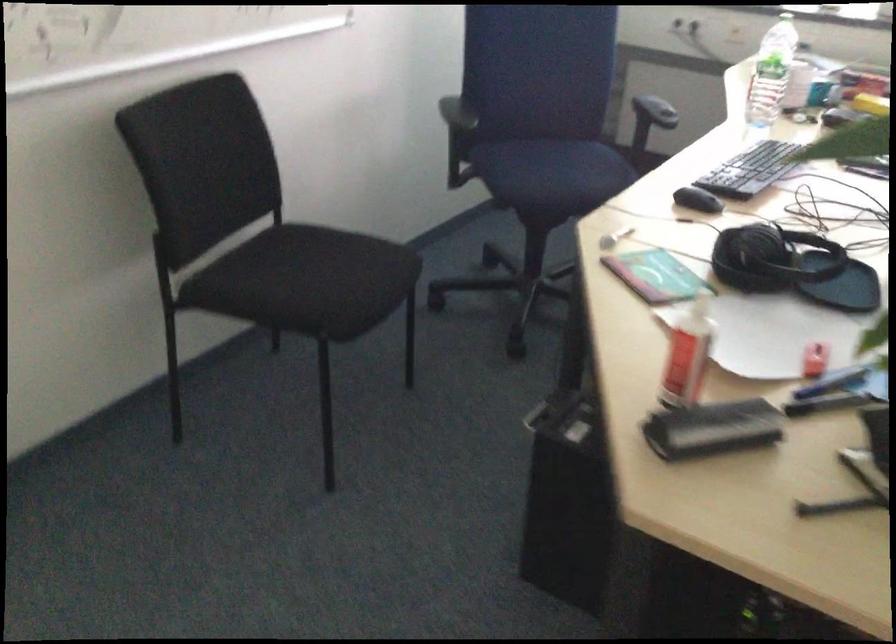
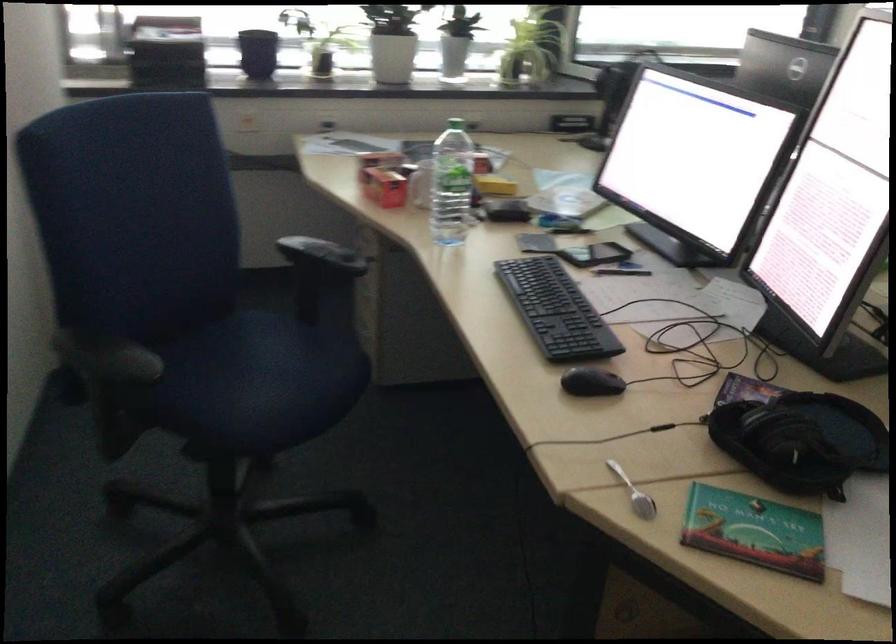
Find the pixel in the second image that matches point (753, 254) in the first image.

(800, 440)